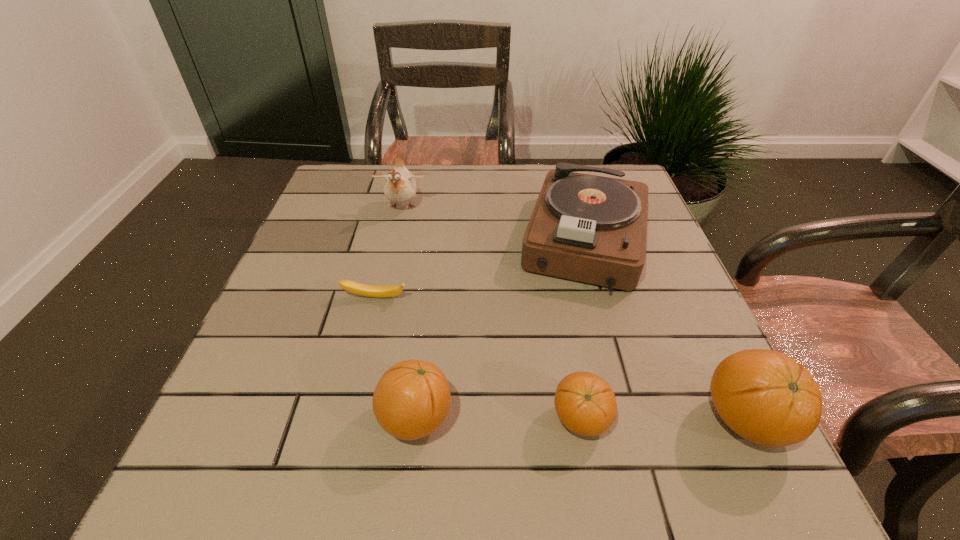
The height and width of the screenshot is (540, 960). I want to click on the leftmost orange, so click(411, 400).

Find the location of a particular element. the shortest orange is located at coordinates (586, 405).

At what (x,y) coordinates should I click in order to perform the action: click on the second orange from left to right. Please return your answer as a coordinate pair (x, y). This screenshot has height=540, width=960. Looking at the image, I should click on (586, 405).

Where is `the tallest orange`? The image size is (960, 540). the tallest orange is located at coordinates pyautogui.click(x=766, y=397).

Where is `record player`? record player is located at coordinates (593, 229).

Where is `bird`? bird is located at coordinates (400, 187).

The width and height of the screenshot is (960, 540). I want to click on banana, so click(360, 289).

Identify the location of vacant space located on the left of the second tallest orange. (223, 418).

Find the location of a particular element. This screenshot has width=960, height=540. vacant space located 0.200m on the left of the shortest orange is located at coordinates (x=431, y=419).

Where is `free spot located 0.360m on the left of the rightmost orange`? Image resolution: width=960 pixels, height=540 pixels. free spot located 0.360m on the left of the rightmost orange is located at coordinates (485, 420).